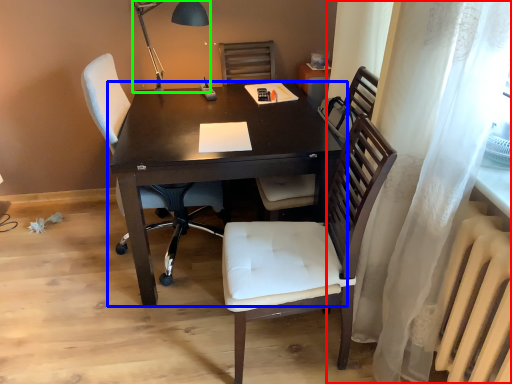
Question: Which object is positioned farthest from curtain (highlighted by a red box)? Select from desk (highlighted by a blue box) and table lamp (highlighted by a green box).

Choices:
 (A) desk
 (B) table lamp

Answer: (B)